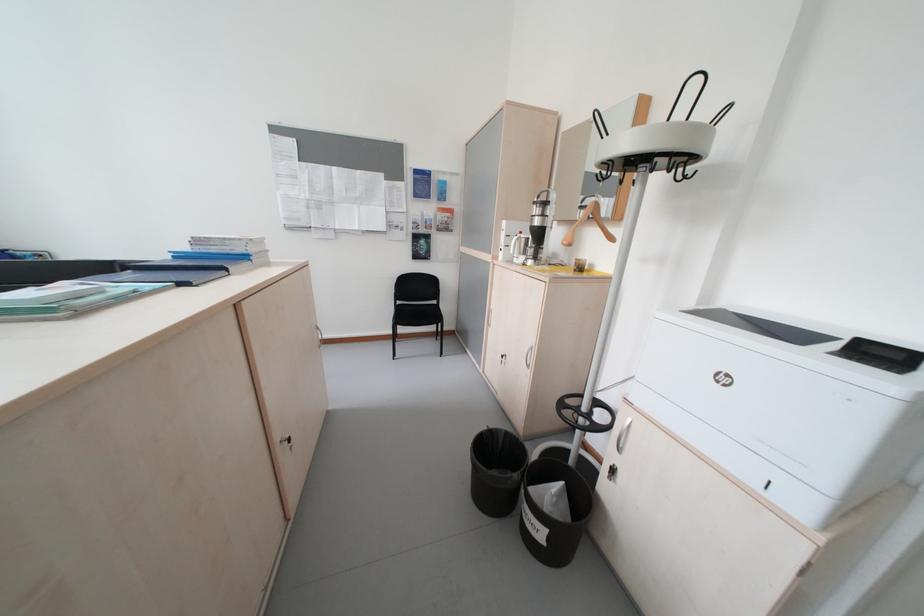
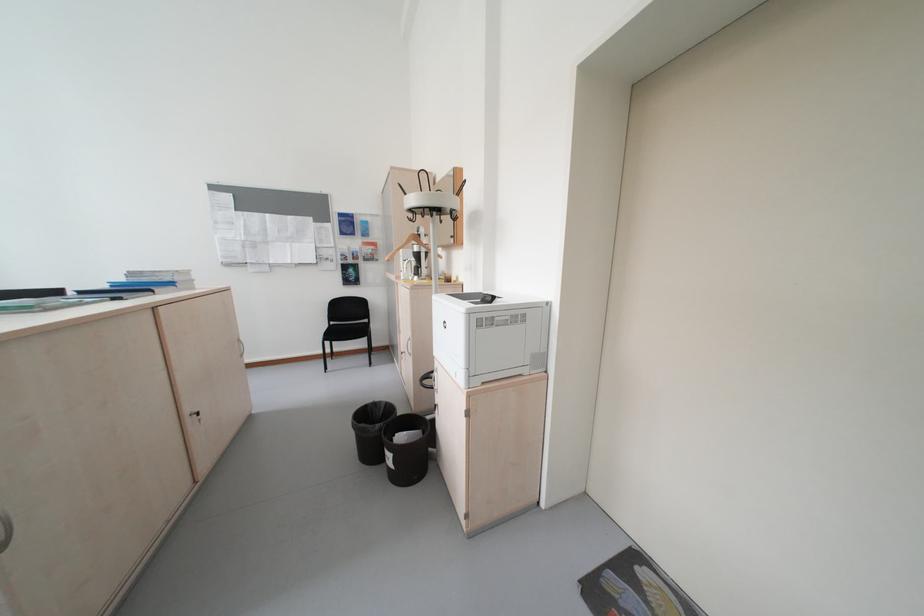
Locate, in the second image, the point that corresponds to [290,451] in the first image.

(200, 421)